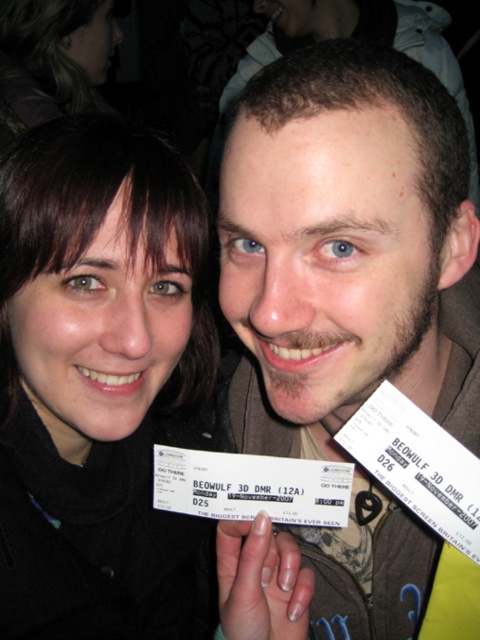
Question: Can you confirm if black matte ticket at center is bigger than brown textured jacket at center?

Choices:
 (A) yes
 (B) no

Answer: (A)

Question: From the image, what is the correct spatial relationship of black matte ticket at center in relation to brown textured jacket at center?

Choices:
 (A) right
 (B) left

Answer: (B)

Question: Which point appears farthest from the camera in this image?

Choices:
 (A) (469, 244)
 (B) (106, 196)

Answer: (A)

Question: Which point is farther to the camera?

Choices:
 (A) black matte ticket at center
 (B) brown textured jacket at center

Answer: (A)

Question: Considering the relative positions of black matte ticket at center and brown textured jacket at center in the image provided, where is black matte ticket at center located with respect to brown textured jacket at center?

Choices:
 (A) left
 (B) right

Answer: (A)